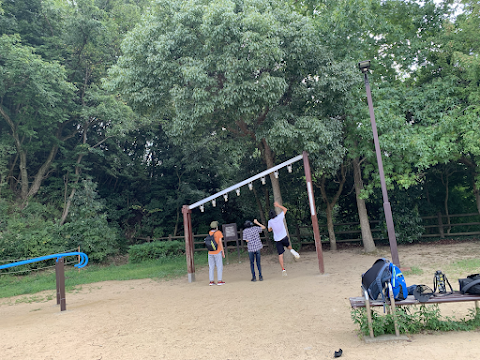
Locate an element on the screen. The width and height of the screenshot is (480, 360). light is located at coordinates (358, 62).